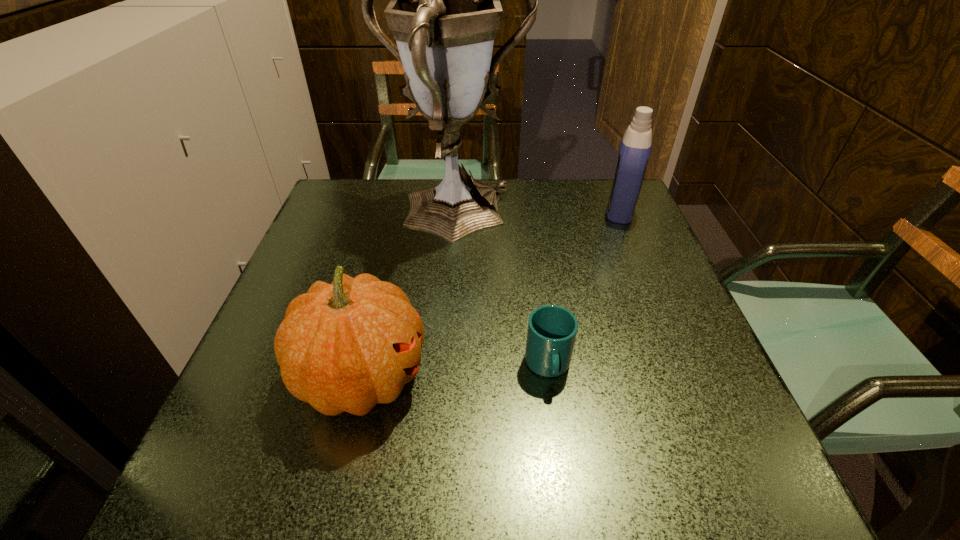
In the image, there is a desktop. Where is `vacant space at the near left corner`? The image size is (960, 540). vacant space at the near left corner is located at coordinates (269, 504).

In the image, there is a desktop. Where is `free space at the near right corner`? This screenshot has width=960, height=540. free space at the near right corner is located at coordinates (723, 478).

You are a GUI agent. You are given a task and a screenshot of the screen. Output one action in this format:
    pyautogui.click(x=<x>, y=<y>)
    Task: Click on the free space that is in between the tallest object and the shortest object
    The width and height of the screenshot is (960, 540).
    Given the screenshot: What is the action you would take?
    pyautogui.click(x=501, y=292)

The image size is (960, 540). I want to click on vacant region between the cup and the detergent, so click(x=585, y=288).

The width and height of the screenshot is (960, 540). I want to click on free space between the second shortest object and the shortest object, so click(455, 372).

Find the location of `free space between the cup and the trophy cup`. free space between the cup and the trophy cup is located at coordinates [x=501, y=292].

Locate an element on the screen. This screenshot has width=960, height=540. vacant space that is in between the trophy cup and the pumpkin is located at coordinates (408, 298).

This screenshot has height=540, width=960. I want to click on vacant space that is in between the rightmost object and the tallest object, so click(538, 214).

At what (x,y) coordinates should I click in order to perform the action: click on vacant region between the third tallest object and the shortest object. Please return your answer as a coordinate pair (x, y). The height and width of the screenshot is (540, 960). Looking at the image, I should click on (455, 372).

At what (x,y) coordinates should I click in order to perform the action: click on vacant region between the pumpkin and the tallest object. Please return your answer as a coordinate pair (x, y). Image resolution: width=960 pixels, height=540 pixels. Looking at the image, I should click on (408, 298).